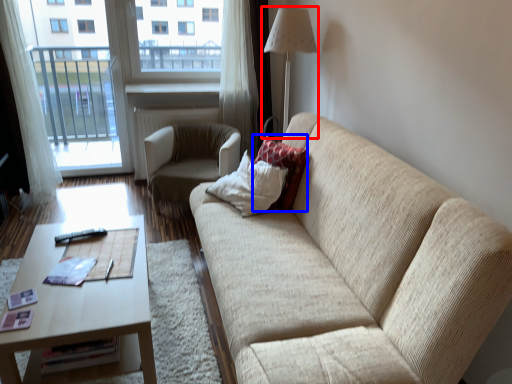
Question: Which of the following is the closest to the observer, table lamp (highlighted by a red box) or pillow (highlighted by a blue box)?

Choices:
 (A) table lamp
 (B) pillow

Answer: (B)